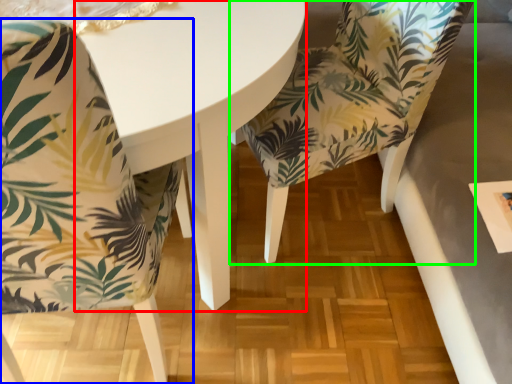
Question: Considering the real-world distances, which object is closest to round table (highlighted by a red box)? chair (highlighted by a blue box) or chair (highlighted by a green box).

Choices:
 (A) chair
 (B) chair

Answer: (A)